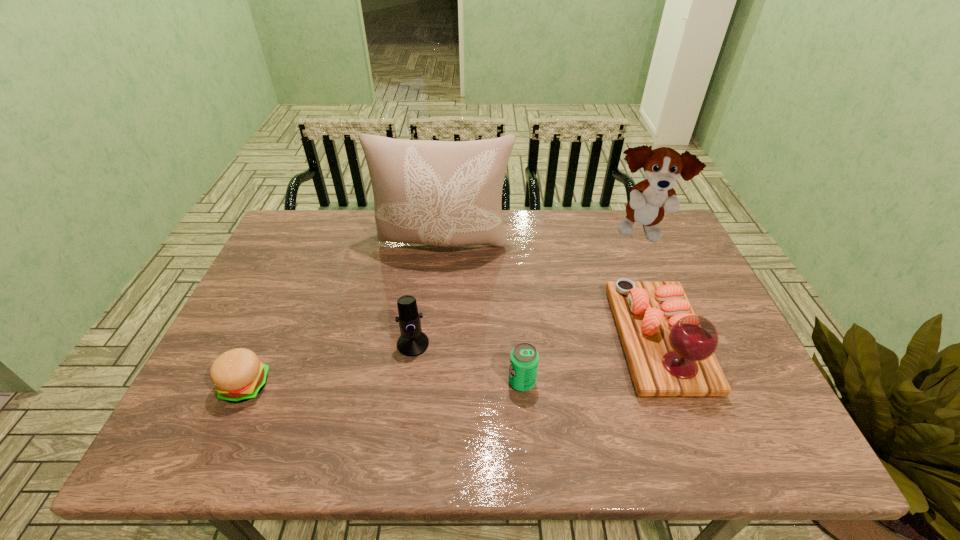
Where is `free spot between the shortest object and the pop soda`? The image size is (960, 540). free spot between the shortest object and the pop soda is located at coordinates (384, 384).

Identify the location of free spot between the microphone and the platter. (536, 342).

The image size is (960, 540). I want to click on free space between the leftmost object and the cushion, so click(345, 315).

This screenshot has height=540, width=960. Identify the location of unoccupied position between the tallest object and the leftmost object. (345, 315).

Where is `blank region between the leftmost object and the tallest object`? This screenshot has height=540, width=960. blank region between the leftmost object and the tallest object is located at coordinates (345, 315).

Locate which object ranks fifth in proximity to the hamburger. Please provide its 2D coordinates. Your answer should be formatted as a tuple, i.e. [(x, y)], where the tuple contains the x and y coordinates of a point satisfying the conditions above.

[(649, 199)]

Where is `object that stands as the third closest to the second shortest object`? object that stands as the third closest to the second shortest object is located at coordinates (445, 193).

Find the location of a particular element. Image resolution: width=960 pixels, height=540 pixels. free location that satisfies the following two spatial constraints: 1. on the front side of the platter; 2. on the left side of the cushion is located at coordinates (435, 340).

At what (x,y) coordinates should I click in order to perform the action: click on vacant region that satisfies the following two spatial constraints: 1. on the back side of the platter; 2. on the left side of the leftmost object. Please return your answer as a coordinate pair (x, y). The width and height of the screenshot is (960, 540). Looking at the image, I should click on (266, 340).